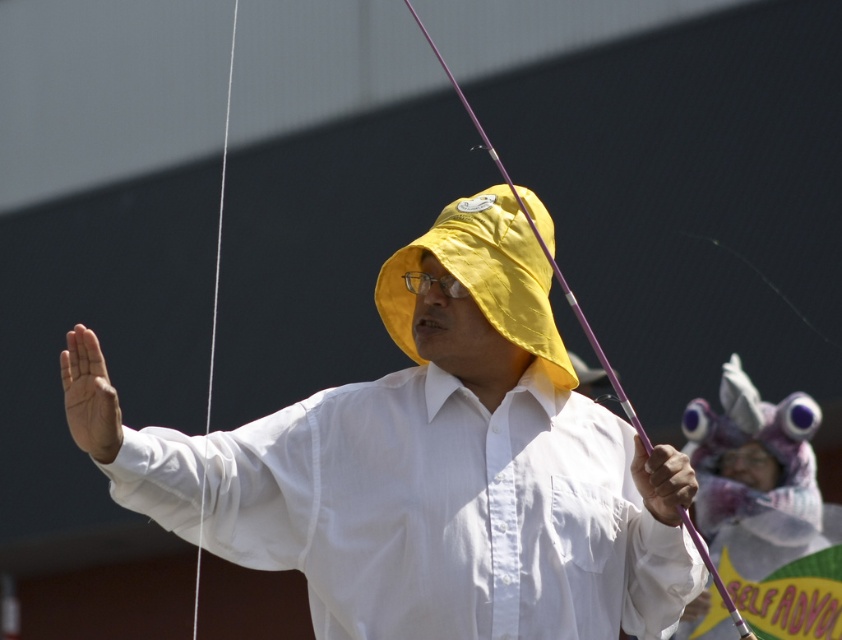
Question: Does white smooth shirt at center have a greater width compared to white string at left?

Choices:
 (A) yes
 (B) no

Answer: (A)

Question: Which object is farther from the camera taking this photo?

Choices:
 (A) white string at left
 (B) yellow fabric hat at center
 (C) white smooth shirt at center
 (D) purple glossy fishing pole at center

Answer: (B)

Question: Is yellow fabric hat at center bigger than white string at left?

Choices:
 (A) yes
 (B) no

Answer: (B)

Question: Is yellow fabric hat at center to the right of white string at left from the viewer's perspective?

Choices:
 (A) no
 (B) yes

Answer: (B)

Question: Which object is positioned closest to the purple glossy fishing pole at center?

Choices:
 (A) white string at left
 (B) white smooth shirt at center
 (C) yellow fabric hat at center

Answer: (B)

Question: Which of the following is the closest to the observer?

Choices:
 (A) (392, 403)
 (B) (217, 273)

Answer: (A)